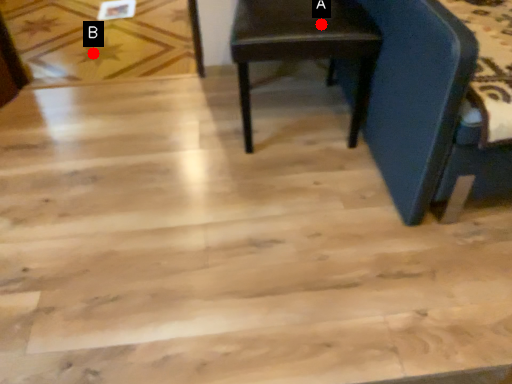
Question: Two points are circled on the image, labeled by A and B beside each circle. Which point is closer to the camera?

Choices:
 (A) A is closer
 (B) B is closer

Answer: (A)